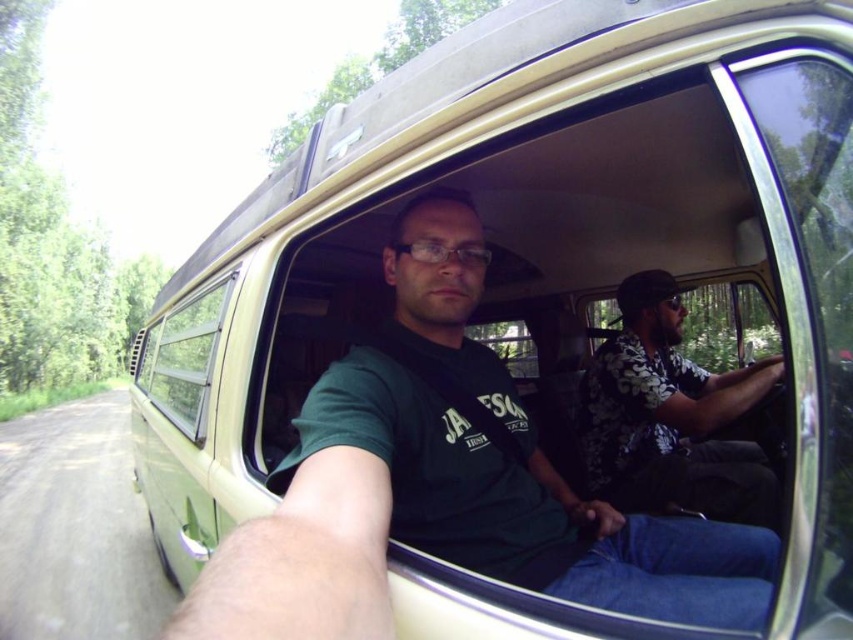
Question: Can you confirm if green matte shirt at center is positioned above floral shirt at center?

Choices:
 (A) no
 (B) yes

Answer: (A)

Question: Which object appears farthest from the camera in this image?

Choices:
 (A) floral shirt at center
 (B) green matte shirt at center

Answer: (A)

Question: Is the position of floral shirt at center more distant than that of clear glass window at center?

Choices:
 (A) yes
 (B) no

Answer: (B)

Question: Is floral shirt at center to the right of clear glass window at center from the viewer's perspective?

Choices:
 (A) yes
 (B) no

Answer: (A)

Question: Estimate the real-world distances between objects in this image. Which object is closer to the clear glass window at center?

Choices:
 (A) green matte shirt at center
 (B) floral shirt at center

Answer: (A)

Question: Estimate the real-world distances between objects in this image. Which object is closer to the clear glass window at center?

Choices:
 (A) floral shirt at center
 (B) green matte shirt at center

Answer: (B)